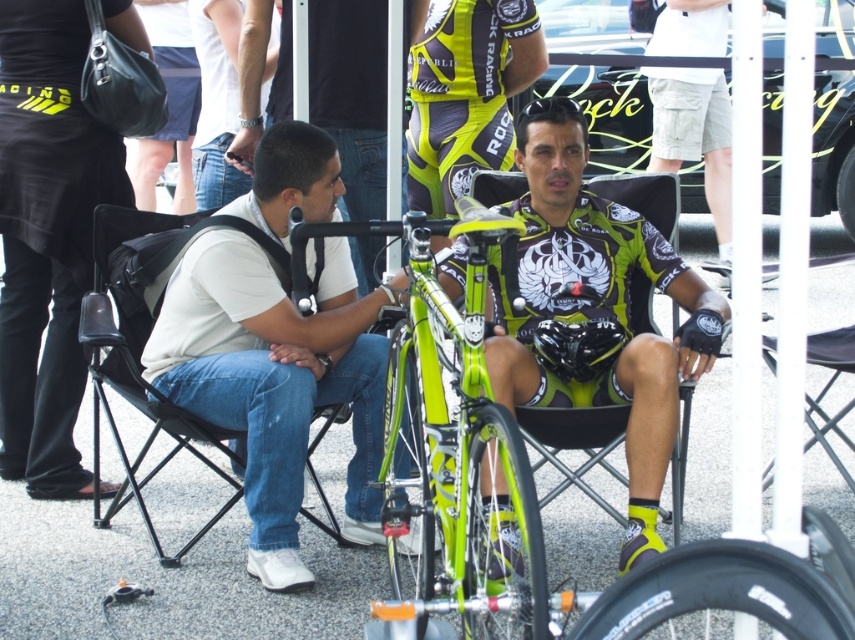
Looking at this image, you are standing in front of the two people at the cycling event. You notice two points marked in the scene. Which point is closer to you, point at coordinates (x=612, y=349) or point at coordinates (x=432, y=509)?

Point at coordinates (x=612, y=349) is closer to you because it is further to the viewer than point at coordinates (x=432, y=509).

You are a photographer positioned at the back of the scene. You want to take a photo of the green matte cycling jersey at center and the green matte bicycle tire at center. Which object should you focus on first to ensure it appears sharp in the photo?

The green matte cycling jersey at center is further to the viewer than the green matte bicycle tire at center, so you should focus on the green matte cycling jersey at center first to ensure it appears sharp in the photo.

You are organizing a cycling event and need to arrange seating for participants. There are two people sitting on chairs at the event. The first person is sitting on the black fabric chair at left, and the second person is sitting on a green cycling jersey. How far apart are these two chairs?

The two chairs are 4.10 meters apart.